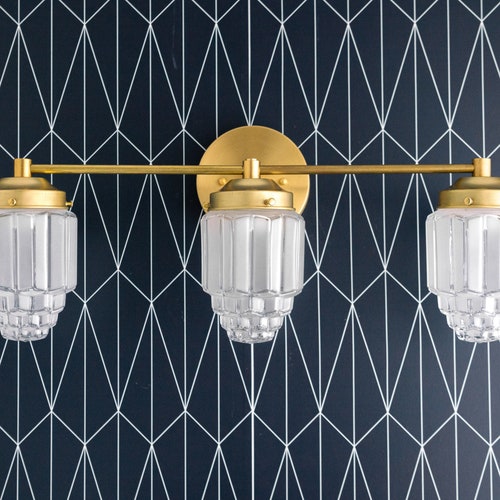
The image size is (500, 500). I want to click on wallpaper, so click(x=368, y=37).